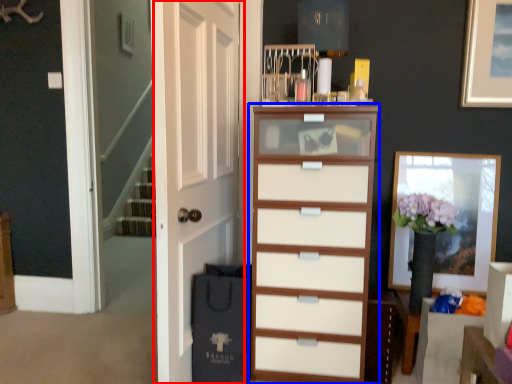
Question: Which object is closer to the camera taking this photo, door (highlighted by a red box) or chest of drawers (highlighted by a blue box)?

Choices:
 (A) door
 (B) chest of drawers

Answer: (A)